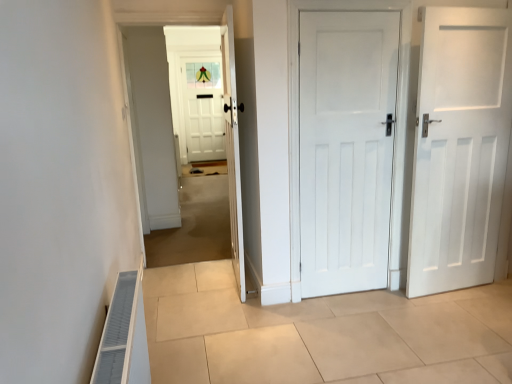
Image resolution: width=512 pixels, height=384 pixels. Find the location of `free space above white painted wood door at center, the second door when ordered from right to left (from a real-world perspective)`. free space above white painted wood door at center, the second door when ordered from right to left (from a real-world perspective) is located at coordinates (355, 8).